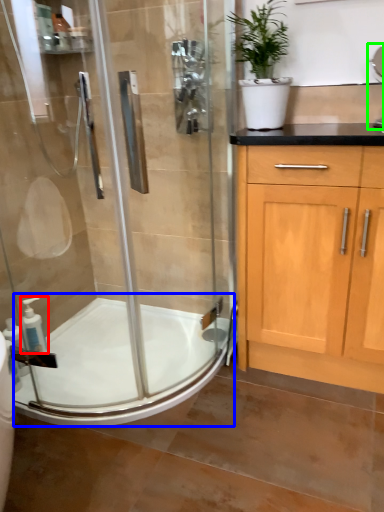
Question: Considering the real-world distances, which object is closest to soap dispenser (highlighted by a red box)? bath (highlighted by a blue box) or sink (highlighted by a green box).

Choices:
 (A) bath
 (B) sink

Answer: (A)